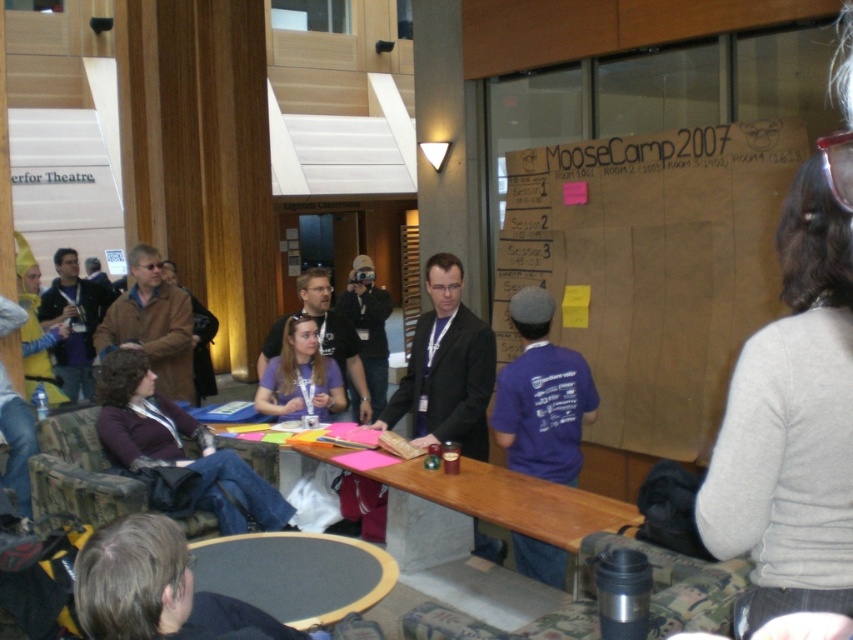
In the scene shown: Which is more to the right, purple cotton shirt at center or black felt table at lower center?

From the viewer's perspective, purple cotton shirt at center appears more on the right side.

Who is more forward, (595,406) or (305,582)?

Point (305,582)

Locate an element on the screen. This screenshot has width=853, height=640. purple cotton shirt at center is located at coordinates (541, 396).

Is the position of black felt table at lower center more distant than that of matte black shirt at center?

No, black felt table at lower center is closer to the viewer.

Which of these two, black felt table at lower center or matte black shirt at center, stands taller?

matte black shirt at center

What do you see at coordinates (294, 573) in the screenshot? I see `black felt table at lower center` at bounding box center [294, 573].

You are a GUI agent. You are given a task and a screenshot of the screen. Output one action in this format:
    pyautogui.click(x=<x>, y=<y>)
    Task: Click on the black felt table at lower center
    This screenshot has height=640, width=853.
    Given the screenshot: What is the action you would take?
    pyautogui.click(x=294, y=573)

Between point (479, 353) and point (268, 595), which one is positioned behind?

The point (479, 353) is more distant.

Which of these two, black suit at center or black felt table at lower center, stands shorter?

Standing shorter between the two is black felt table at lower center.

Describe the element at coordinates (445, 369) in the screenshot. This screenshot has width=853, height=640. I see `black suit at center` at that location.

In order to click on black suit at center in this screenshot , I will do `click(445, 369)`.